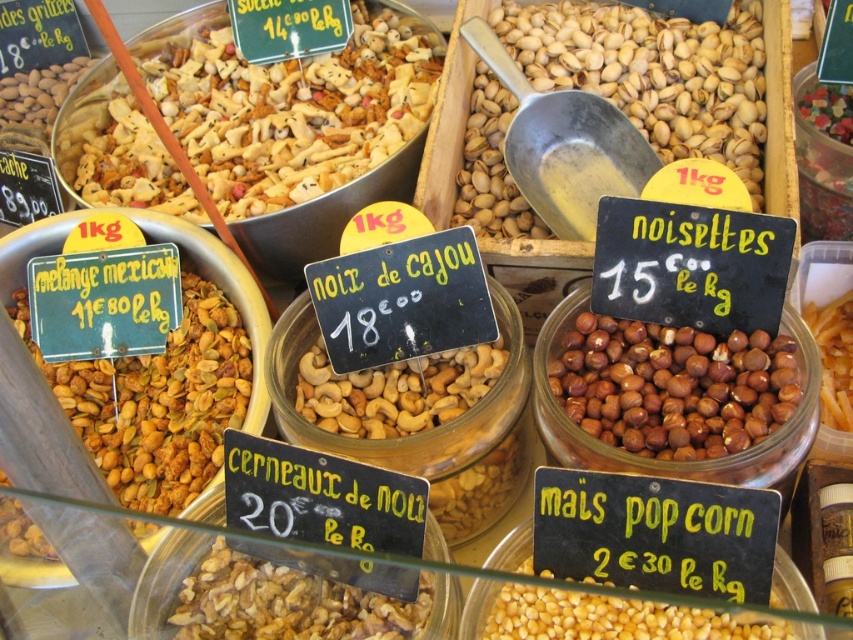
Between shiny metallic nuts at upper left and pistachio nuts at center, which one appears on the right side from the viewer's perspective?

Positioned to the right is pistachio nuts at center.

Identify the location of shiny metallic nuts at upper left. (292, 109).

Is point (270, 172) in front of point (517, 605)?

No, it is behind (517, 605).

Locate an element on the screen. shiny metallic nuts at upper left is located at coordinates (292, 109).

Based on the photo, can you confirm if brown matte mix at left is bigger than yellow matte popcorn at lower center?

Yes.

Who is more forward, (90, 388) or (579, 624)?

Point (579, 624) is in front.

Locate an element on the screen. Image resolution: width=853 pixels, height=640 pixels. brown matte mix at left is located at coordinates (157, 401).